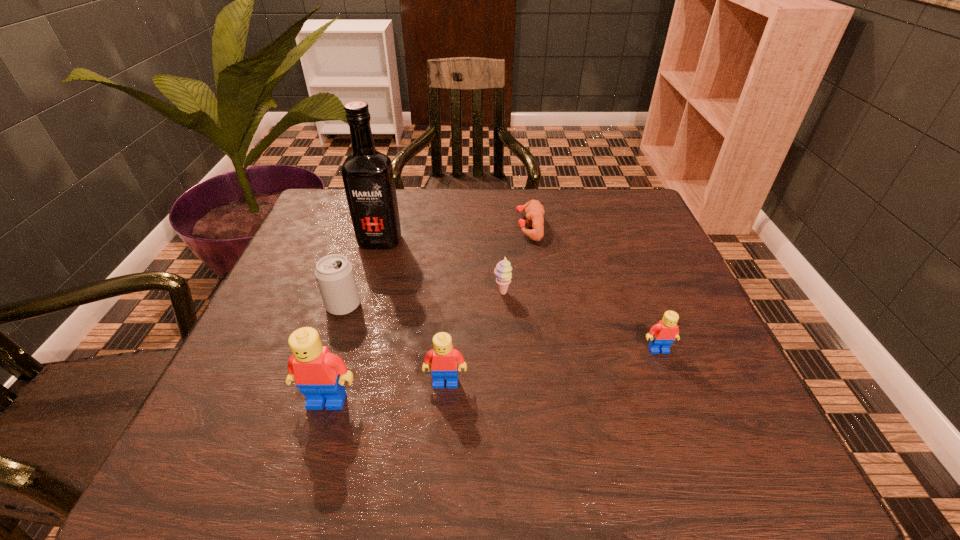
If we want them evenly spaced by inserting an extra Lego among them, please locate a free spot for this new Lego. Please provide its 2D coordinates. Your answer should be formatted as a tuple, i.e. [(x, y)], where the tuple contains the x and y coordinates of a point satisfying the conditions above.

[(556, 366)]